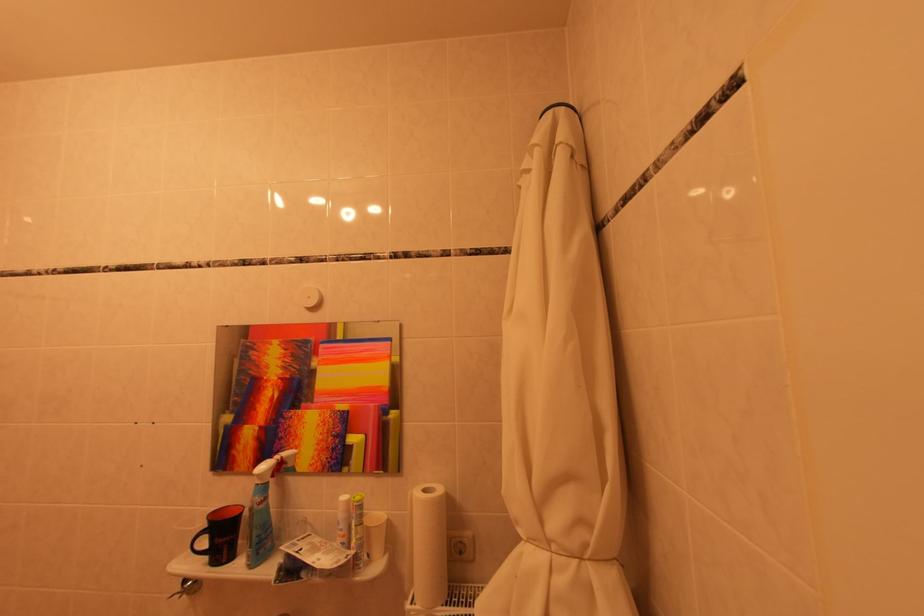
This screenshot has height=616, width=924. What do you see at coordinates (199, 543) in the screenshot? I see `the black mug handle` at bounding box center [199, 543].